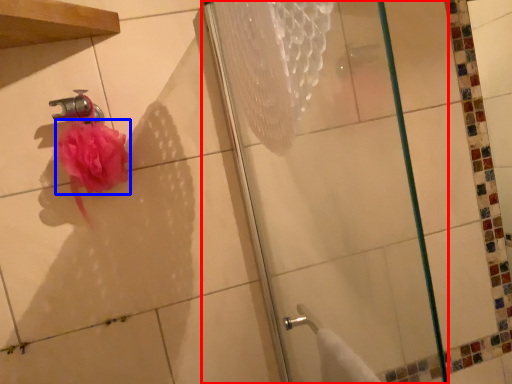
Question: Which point is further to the camera, shower (highlighted by a red box) or flower (highlighted by a blue box)?

Choices:
 (A) shower
 (B) flower

Answer: (B)